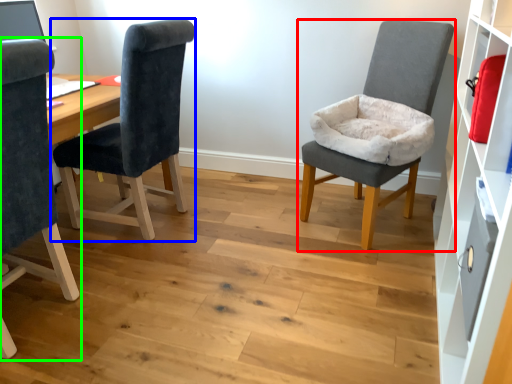
Question: Estimate the real-world distances between objects in this image. Which object is closer to chair (highlighted by a red box), chair (highlighted by a blue box) or chair (highlighted by a green box)?

Choices:
 (A) chair
 (B) chair

Answer: (A)